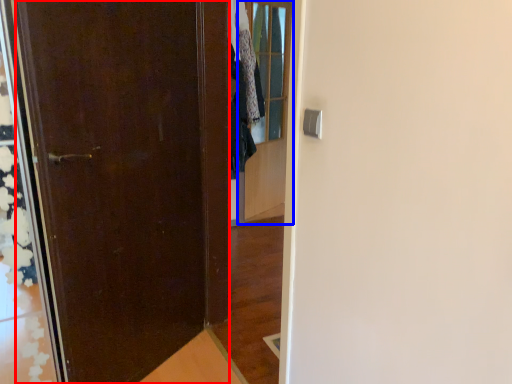
Question: Which object appears closest to the camera in this image, door (highlighted by a red box) or glass door (highlighted by a blue box)?

Choices:
 (A) door
 (B) glass door

Answer: (A)